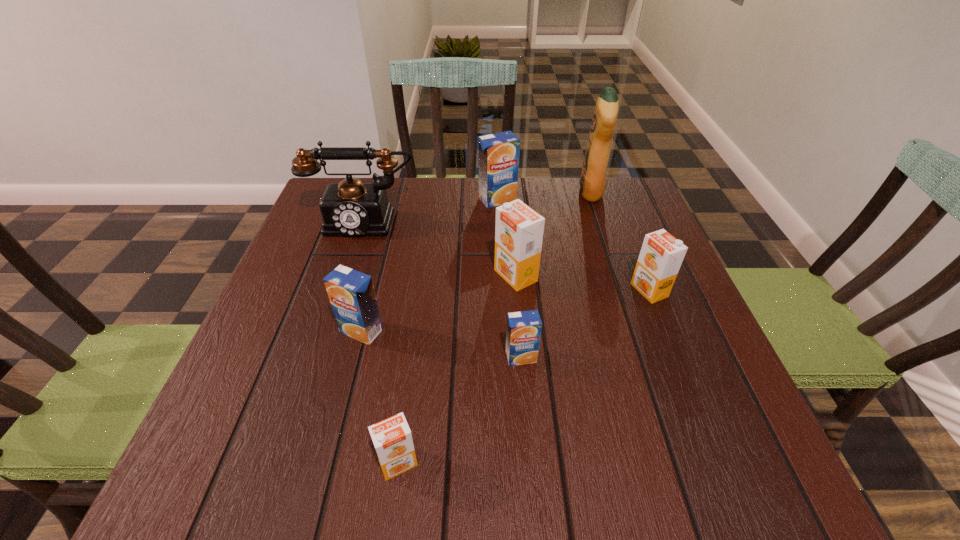
Locate an element on the screen. The image size is (960, 540). detergent is located at coordinates (593, 174).

Where is `gray telephone`? This screenshot has width=960, height=540. gray telephone is located at coordinates (350, 208).

Locate an element on the screen. The height and width of the screenshot is (540, 960). the second tallest object is located at coordinates (350, 208).

I want to click on the farthest blue orange_juice, so click(498, 153).

This screenshot has width=960, height=540. Find the location of `the biggest blue orange_juice`. the biggest blue orange_juice is located at coordinates (498, 153).

This screenshot has height=540, width=960. Find the location of `the biggest orange orange juice`. the biggest orange orange juice is located at coordinates (519, 229).

Identify the location of the third nearest orange juice. This screenshot has width=960, height=540. tap(351, 293).

Where is `the leftmost blue orange_juice`? The image size is (960, 540). the leftmost blue orange_juice is located at coordinates (351, 293).

You are a GUI agent. You are given a task and a screenshot of the screen. Output one action in this format:
    pyautogui.click(x=<x>, y=<y>)
    Task: Click on the rightmost orange juice
    The height and width of the screenshot is (540, 960).
    Given the screenshot: What is the action you would take?
    pyautogui.click(x=661, y=255)

The height and width of the screenshot is (540, 960). In order to click on the rightmost orange orange juice in this screenshot , I will do `click(661, 255)`.